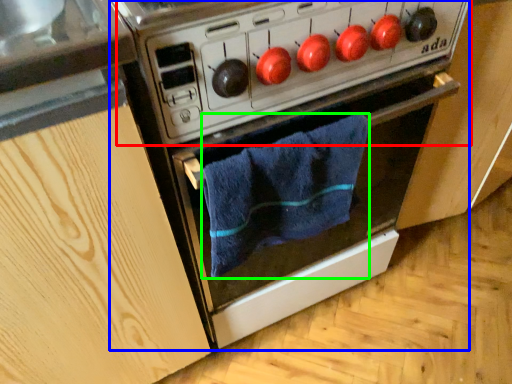
Question: Considering the real-world distances, which object is farthest from appliance (highlighted by a red box)? oven (highlighted by a blue box) or bath towel (highlighted by a green box)?

Choices:
 (A) oven
 (B) bath towel

Answer: (B)